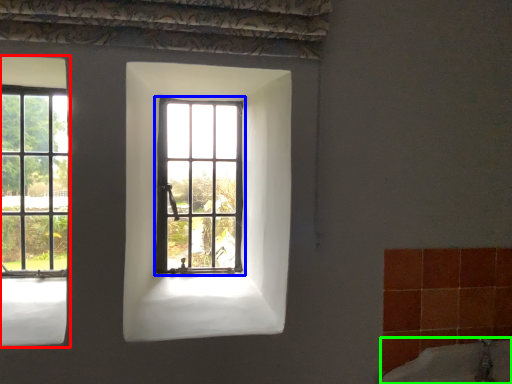
Question: Considering the real-world distances, which object is farthest from window (highlighted by a red box)? window (highlighted by a blue box) or bath (highlighted by a green box)?

Choices:
 (A) window
 (B) bath

Answer: (B)